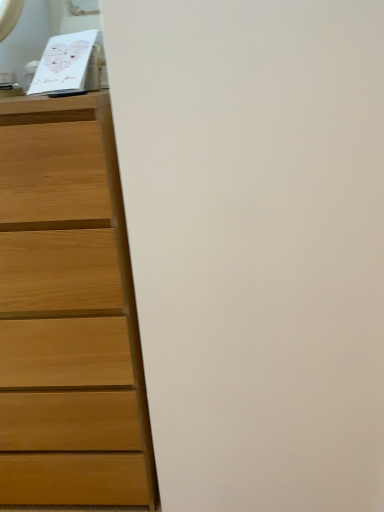
The height and width of the screenshot is (512, 384). Describe the element at coordinates (68, 308) in the screenshot. I see `light wood chest of drawers at left` at that location.

Where is `light wood chest of drawers at left`? light wood chest of drawers at left is located at coordinates (68, 308).

Where is `light wood chest of drawers at left`? light wood chest of drawers at left is located at coordinates (68, 308).